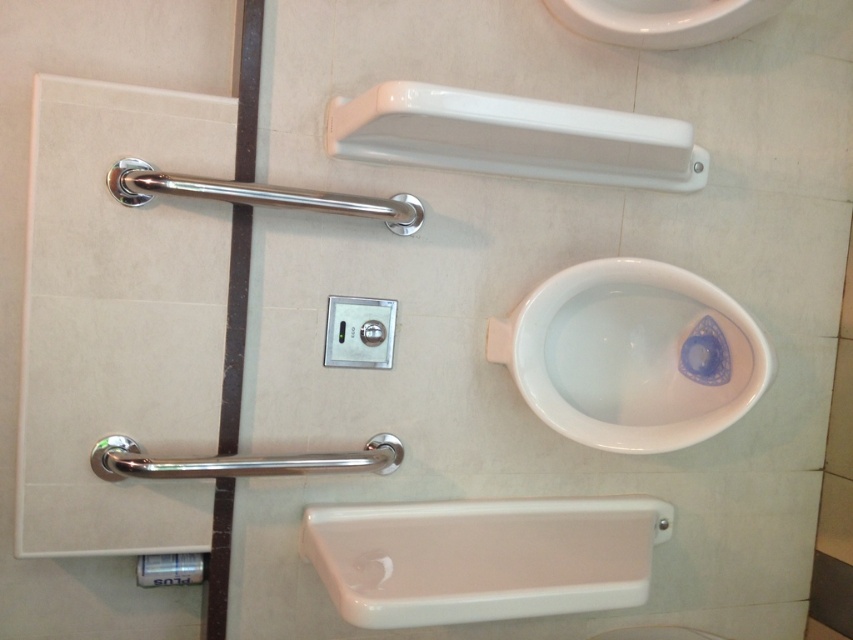
What do you see at coordinates (627, 355) in the screenshot? Image resolution: width=853 pixels, height=640 pixels. I see `white glossy toilet bowl at center` at bounding box center [627, 355].

Who is higher up, white glossy toilet bowl at center or white glossy towel bar at upper center?

white glossy towel bar at upper center is higher up.

Measure the distance between point (604,298) and camera.

Point (604,298) is 4.63 feet from camera.

At what (x,y) coordinates should I click in order to perform the action: click on white glossy toilet bowl at center. Please return your answer as a coordinate pair (x, y). Looking at the image, I should click on (627, 355).

Does white glossy toilet bowl at center have a larger size compared to white glossy sink at upper center?

Indeed, white glossy toilet bowl at center has a larger size compared to white glossy sink at upper center.

Is white glossy toilet bowl at center below white glossy sink at upper center?

Yes.

The image size is (853, 640). What do you see at coordinates (627, 355) in the screenshot? I see `white glossy toilet bowl at center` at bounding box center [627, 355].

At what (x,y) coordinates should I click in order to perform the action: click on white glossy toilet bowl at center. Please return your answer as a coordinate pair (x, y). Looking at the image, I should click on (627, 355).

Can you confirm if white glossy towel bar at upper center is bigger than white glossy sink at upper center?

Correct, white glossy towel bar at upper center is larger in size than white glossy sink at upper center.

The height and width of the screenshot is (640, 853). I want to click on white glossy towel bar at upper center, so click(x=514, y=138).

Who is more distant from viewer, (340, 102) or (787, 3)?

The point (787, 3) is behind.

I want to click on white glossy towel bar at upper center, so click(514, 138).